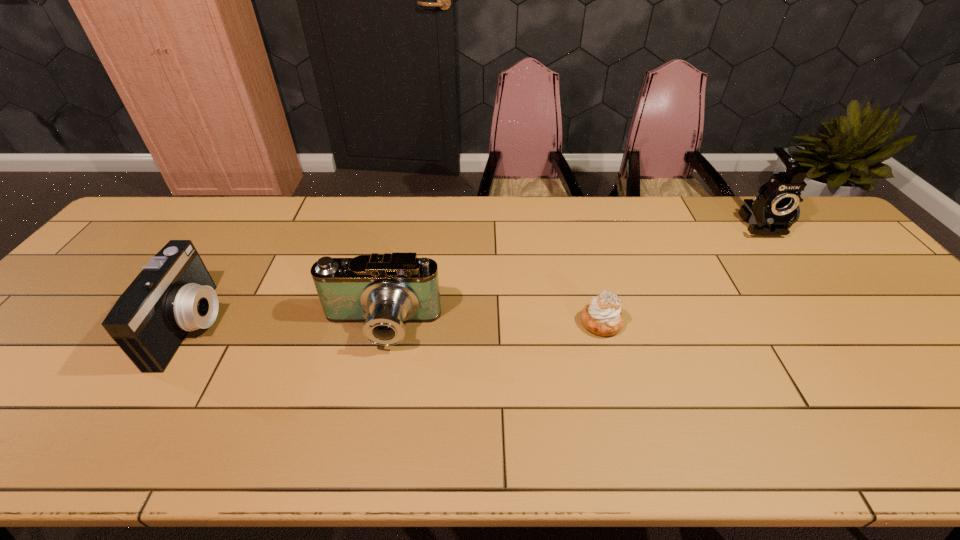
Identify the location of the farthest camcorder. The width and height of the screenshot is (960, 540). (775, 210).

The image size is (960, 540). Identify the location of the rightmost object. (775, 210).

Locate an element on the screen. the third object from right to left is located at coordinates (384, 291).

Locate an element on the screen. This screenshot has width=960, height=540. the leftmost object is located at coordinates (174, 294).

Find the location of a particular element. The width and height of the screenshot is (960, 540). the second object from right to left is located at coordinates (602, 317).

I want to click on the shortest object, so click(602, 317).

Image resolution: width=960 pixels, height=540 pixels. What are the coordinates of `blank area located on the lens mount of the tallest camcorder` in the screenshot? It's located at (794, 265).

You are a GUI agent. You are given a task and a screenshot of the screen. Output one action in this format:
    pyautogui.click(x=<x>, y=<y>)
    Task: Click on the free space located 0.080m on the front-facing side of the second camcorder from right to left
    Image resolution: width=960 pixels, height=540 pixels.
    Given the screenshot: What is the action you would take?
    pyautogui.click(x=368, y=386)

What are the coordinates of `free spot located 0.150m on the lens of the leftmost object` in the screenshot? It's located at (277, 326).

Find the location of a particular element. free space located on the right of the pastry is located at coordinates (641, 323).